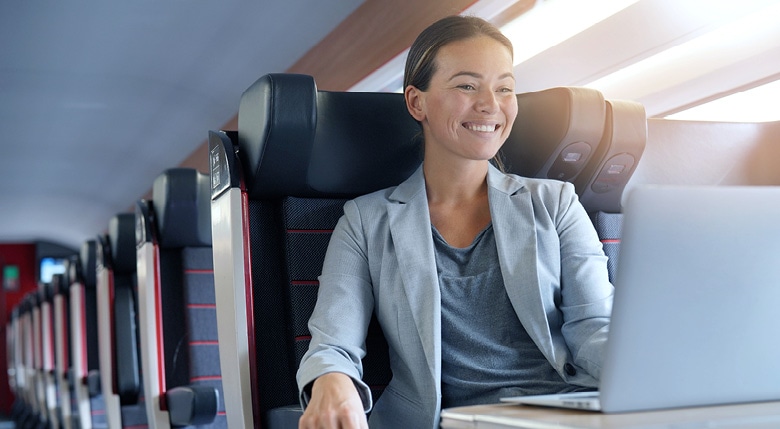
This screenshot has height=429, width=780. What are the coordinates of `the headrest` in the screenshot? It's located at (344, 114).